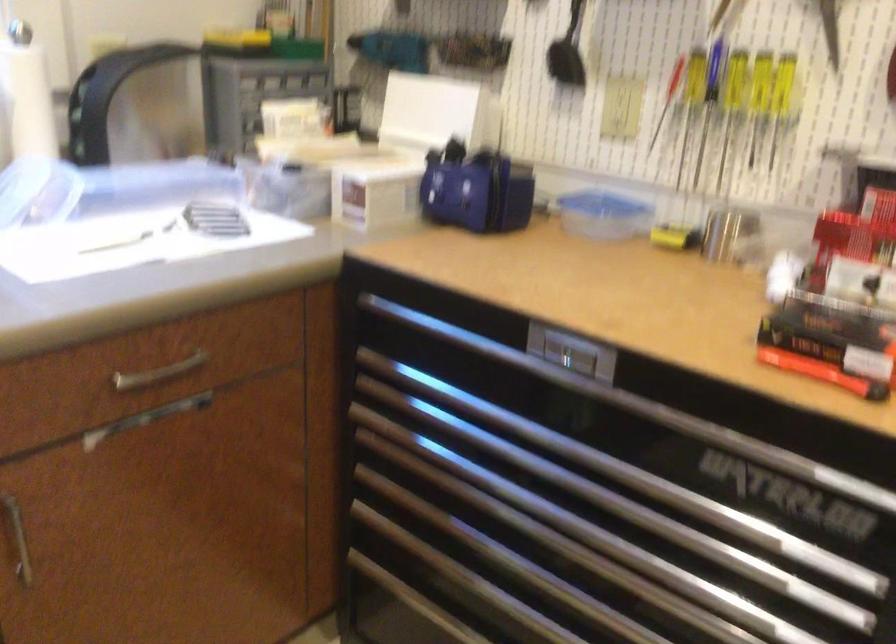
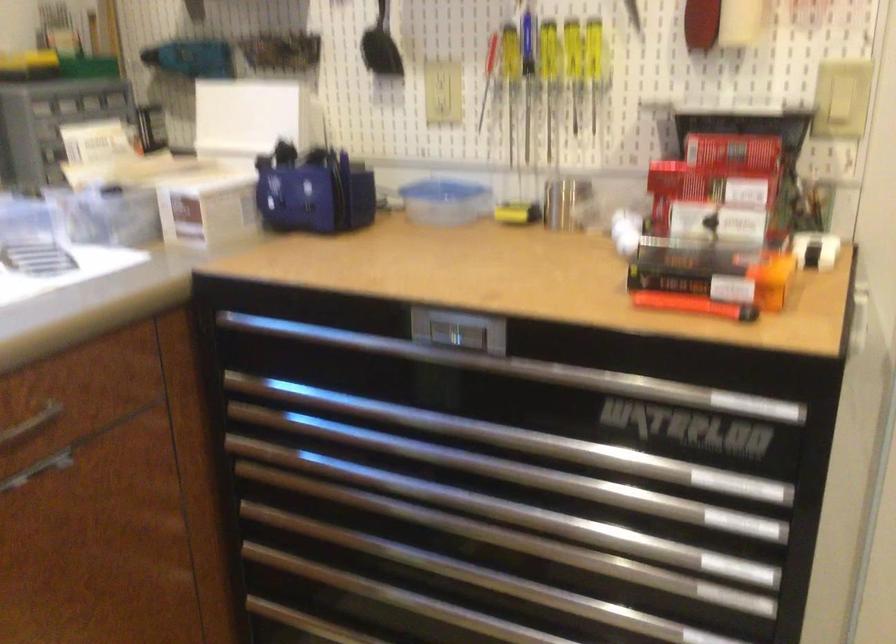
Question: The camera is either moving clockwise (left) or counter-clockwise (right) around the object. The first image is from the beginning of the video and the second image is from the end. Is the camera moving left or right when shooting the video?

Choices:
 (A) Left
 (B) Right

Answer: (A)